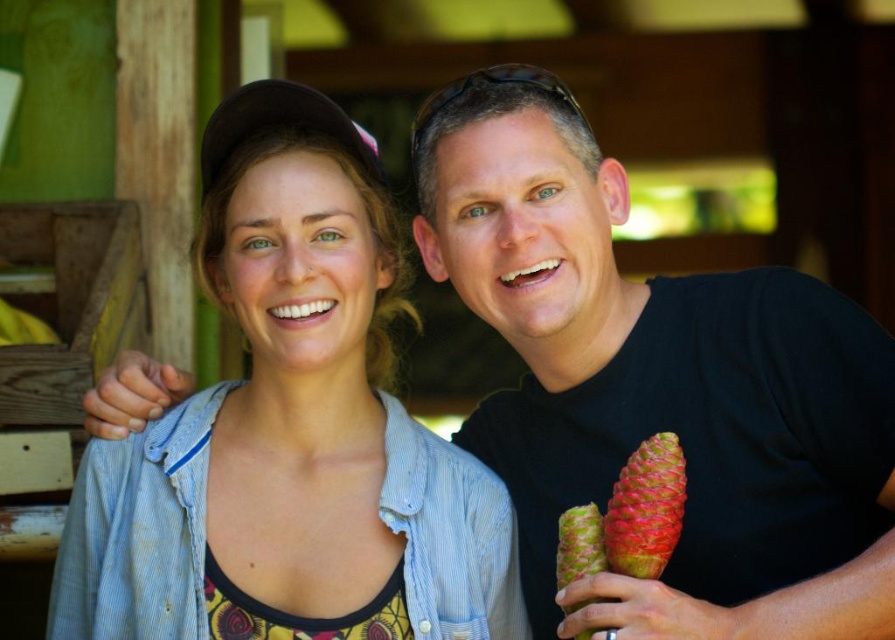
You are a photographer trying to capture the exact location of the black matte pineapple at right in the image. According to the coordinates provided, where is the black matte pineapple located?

The black matte pineapple at right is located at point 0.603 on the x axis and 0.736 on the y axis.

You are a delivery robot with a package that is 12 inches long. You need to place the package between the black matte pineapple at right and the denim jacket at center. Is there enough space between them to fit the package?

The black matte pineapple at right and the denim jacket at center are 12.08 inches apart, so yes, the package can fit between them since the space is slightly larger than the package length.

Based on the photo, you are standing at the point with coordinates point [125,472] and want to walk towards the point [868,358]. According to the image, will you be moving forward or backward?

Since point [868,358] is in front of point [125,472], moving towards it would mean moving forward.